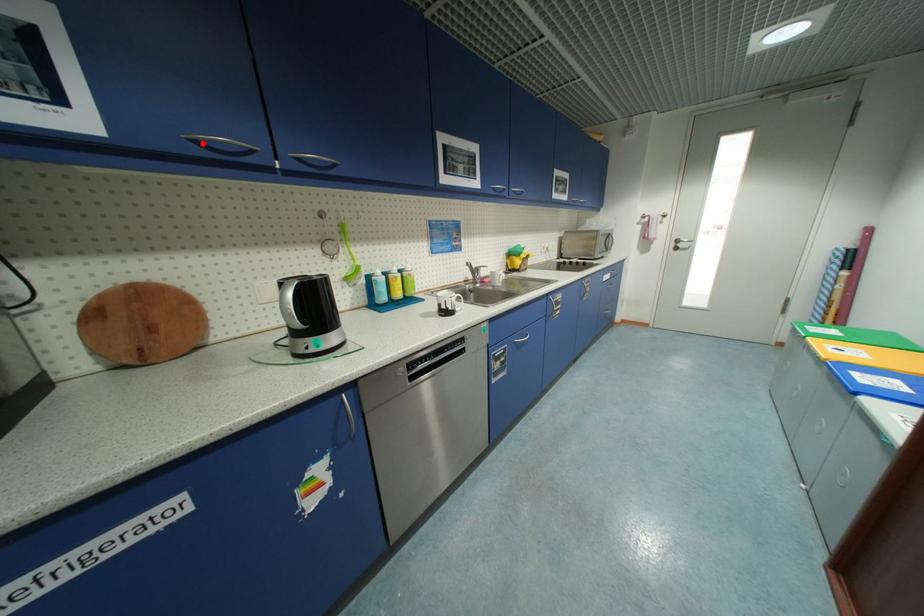
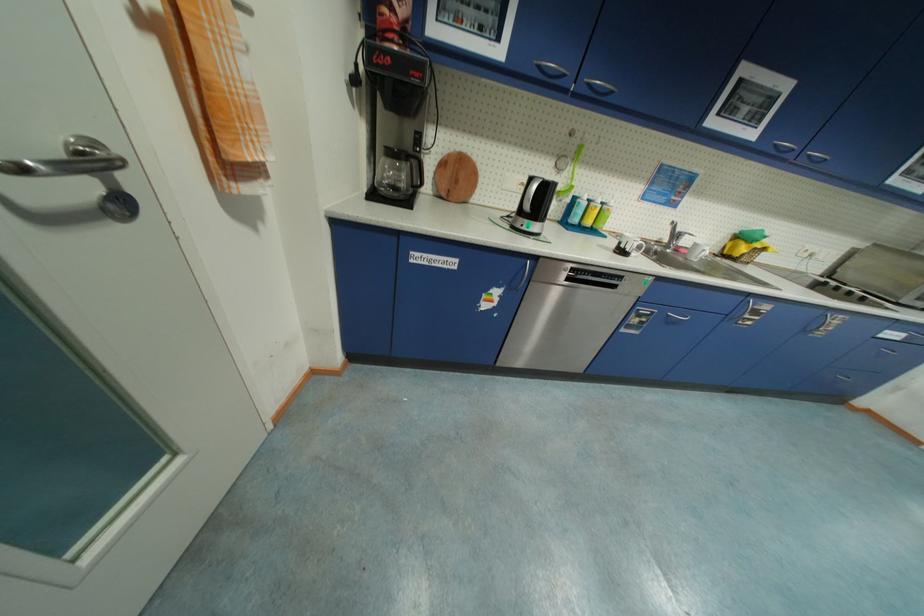
The point at the highlighted location is marked in the first image. Where is the corresponding point in the second image?

(544, 69)